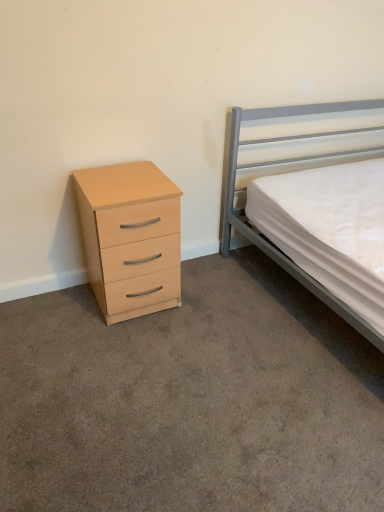
Identify the location of free location to the right of matte wood chest of drawers at left. (210, 298).